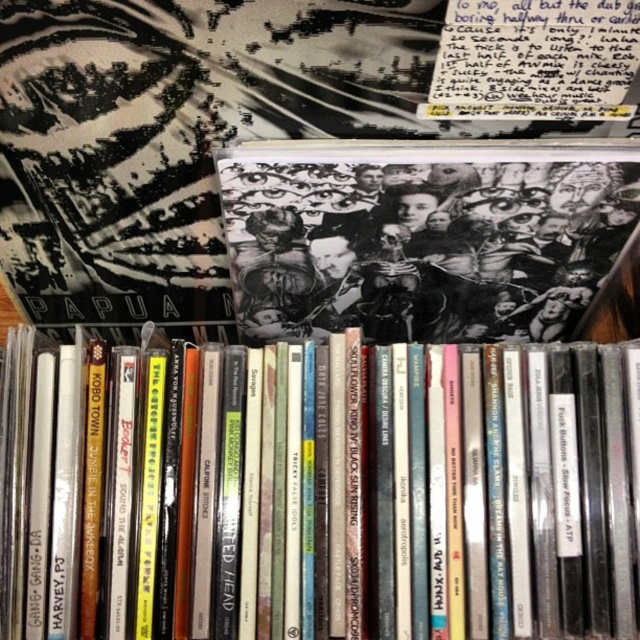
Question: From the image, what is the correct spatial relationship of matte black book at center in relation to black matte book at center?

Choices:
 (A) right
 (B) left

Answer: (B)

Question: Which point is closer to the camera?

Choices:
 (A) matte black book at center
 (B) black matte book at center

Answer: (A)

Question: Which of the following is the farthest from the observer?

Choices:
 (A) (330, 157)
 (B) (170, 369)

Answer: (B)

Question: Does matte black book at center appear over black matte book at center?

Choices:
 (A) yes
 (B) no

Answer: (B)

Question: Does matte black book at center come in front of black matte book at center?

Choices:
 (A) no
 (B) yes

Answer: (B)